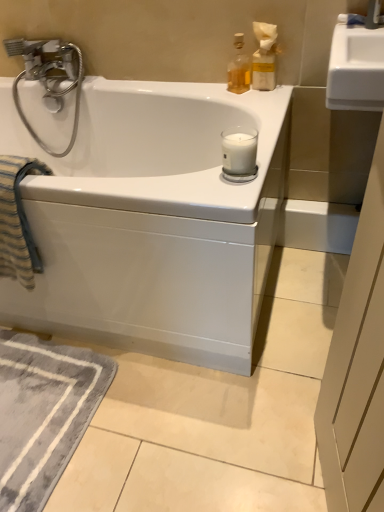
Question: Considering the positions of gray soft rug at lower left and striped cotton beach towel at left in the image, is gray soft rug at lower left bigger or smaller than striped cotton beach towel at left?

Choices:
 (A) big
 (B) small

Answer: (B)

Question: In terms of width, does gray soft rug at lower left look wider or thinner when compared to striped cotton beach towel at left?

Choices:
 (A) thin
 (B) wide

Answer: (B)

Question: Which of these objects is positioned farthest from the striped cotton beach towel at left?

Choices:
 (A) translucent glass bottle at upper right, acting as the first bottle starting from the left
 (B) white glossy bathtub at center
 (C) white matte glass candle at upper right
 (D) gray soft rug at lower left
 (E) translucent glass bottle at upper right, the 2th bottle in the left-to-right sequence

Answer: (E)

Question: Which object is positioned farthest from the translucent glass bottle at upper right, which is the first bottle from right to left?

Choices:
 (A) translucent glass bottle at upper right, arranged as the 2th bottle when viewed from the right
 (B) white glossy bathtub at center
 (C) striped cotton beach towel at left
 (D) white matte glass candle at upper right
 (E) gray soft rug at lower left

Answer: (E)